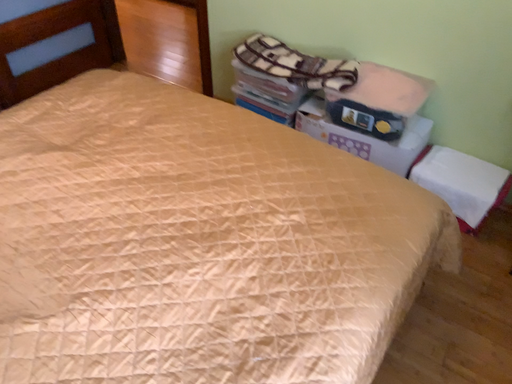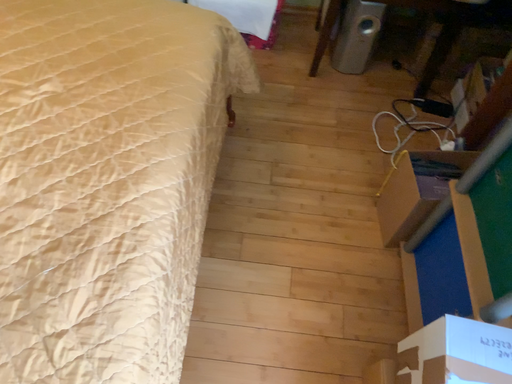
Question: How did the camera likely rotate when shooting the video?

Choices:
 (A) rotated left
 (B) rotated right

Answer: (B)